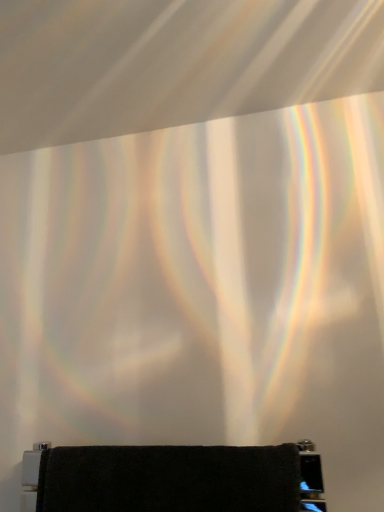
Describe the element at coordinates (169, 479) in the screenshot. This screenshot has width=384, height=512. I see `black terry cloth towel at lower center` at that location.

Locate an element on the screen. black terry cloth towel at lower center is located at coordinates (169, 479).

Locate an element on the screen. black terry cloth towel at lower center is located at coordinates (169, 479).